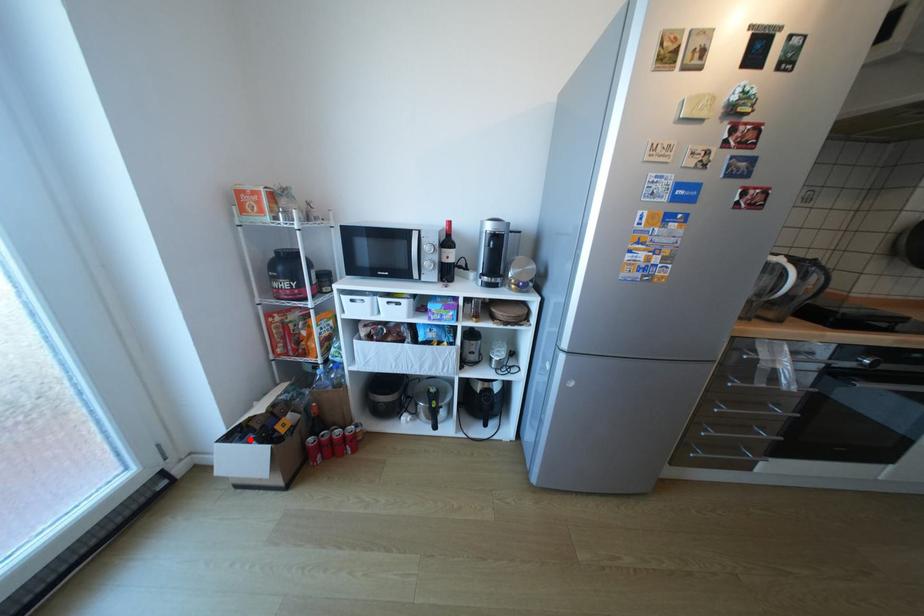
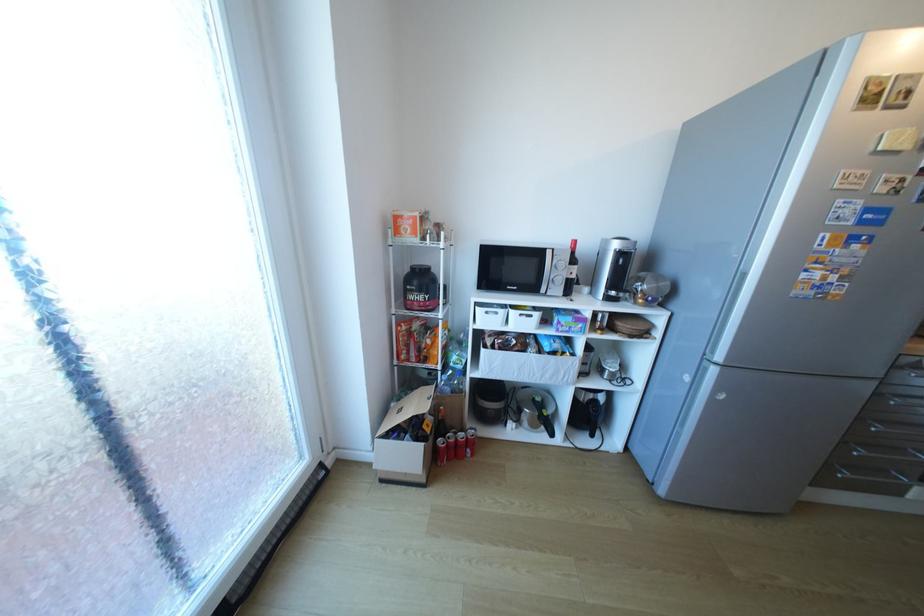
The point at the highlighted location is marked in the first image. Where is the corresponding point in the second image?

(407, 437)